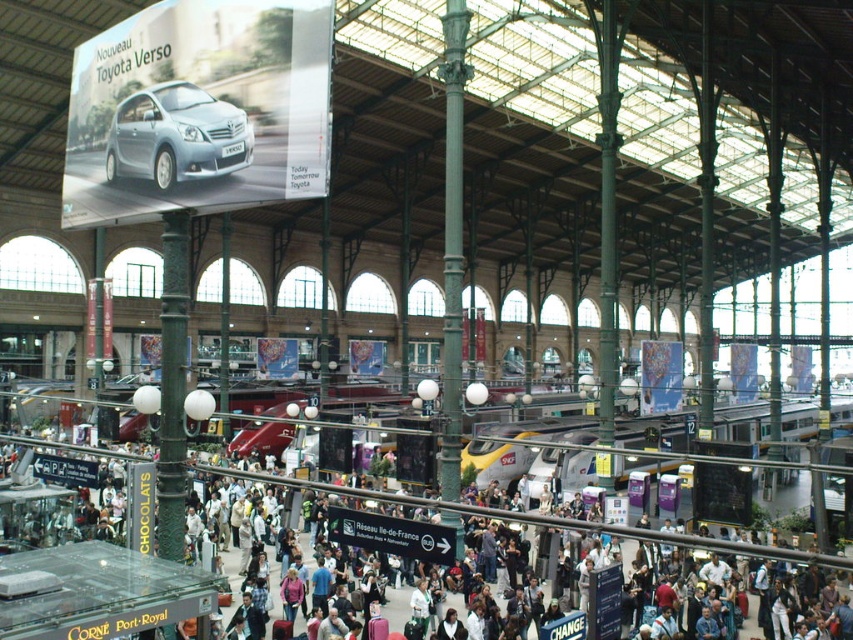
You are standing in the train station and want to take a photo of the point at coordinates (248, 140). The camera you have can focus on objects up to 30 meters away. Will the camera be able to focus on that point?

The distance of point (248, 140) from viewer is 33.30 meters, which is beyond the camera focus limit of 30 meters. The camera will not be able to focus on that point.

You are a photographer at the train station and want to capture both the silver metallic car at upper left and the matte black crowd at center in a single shot. Which object should you focus on first to ensure both are in frame?

You should focus on the silver metallic car at upper left first because it is positioned above the matte black crowd at center, so adjusting the camera angle to include the upper area will ensure both are captured.

You are a photographer positioned at the entrance of the train station. You want to take a photo of the silver metallic car at upper left without the matte black crowd at center appearing in the frame. Is this possible based on their positions?

The matte black crowd at center is behind the silver metallic car at upper left, so yes, you can take a photo of the silver metallic car at upper left without the matte black crowd at center appearing in the frame by positioning yourself so the car blocks the crowd from view.